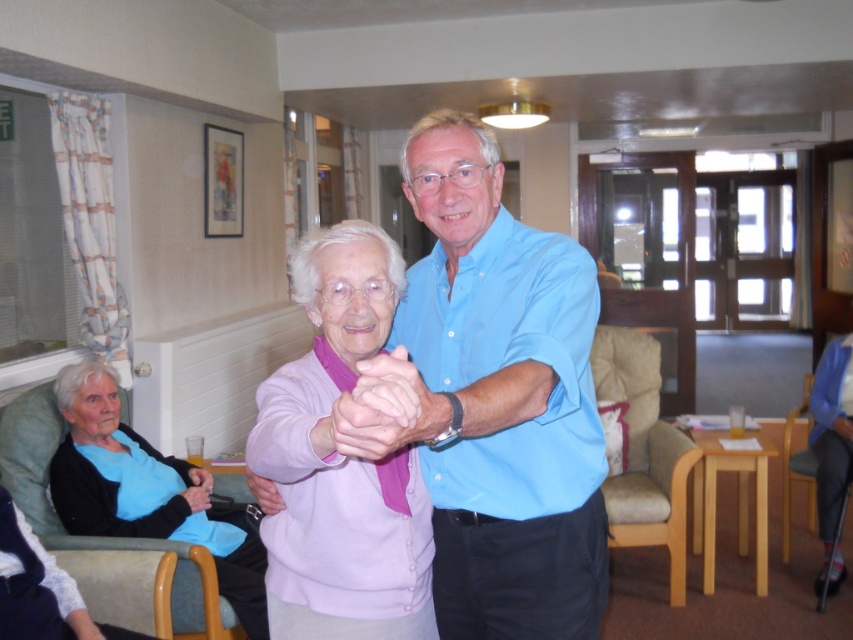
You are standing in the room and want to hand a drink to the person wearing the light blue fabric shirt at lower left. If you can reach 8 feet, will you be able to hand it without moving closer?

The light blue fabric shirt at lower left and viewer are 7.95 feet apart, so yes, you can hand the drink since the distance is within your reach of 8 feet.

You are a photographer standing in the room and want to take a photo of the light blue fabric shirt at lower left and the pink fabric hand at center. Since you have a camera with a 1.5 meter minimum focus distance, will you be able to capture both subjects clearly in the same frame?

The light blue fabric shirt at lower left is 1.94 meters away from the pink fabric hand at center. Since the minimum focus distance is 1.5 meters, the photographer can capture both subjects clearly as the distance between them is greater than the minimum requirement.